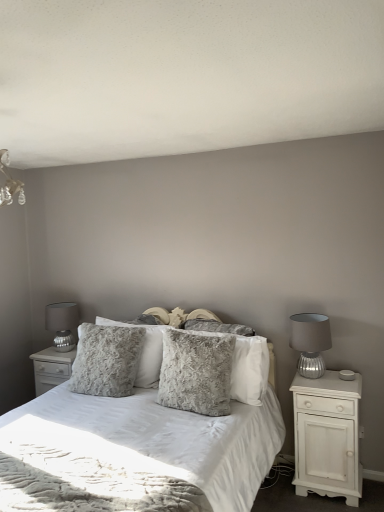
The width and height of the screenshot is (384, 512). I want to click on vacant area on top of white wood nightstand at right, arranged as the 2th nightstand when viewed from the left (from a real-world perspective), so click(326, 377).